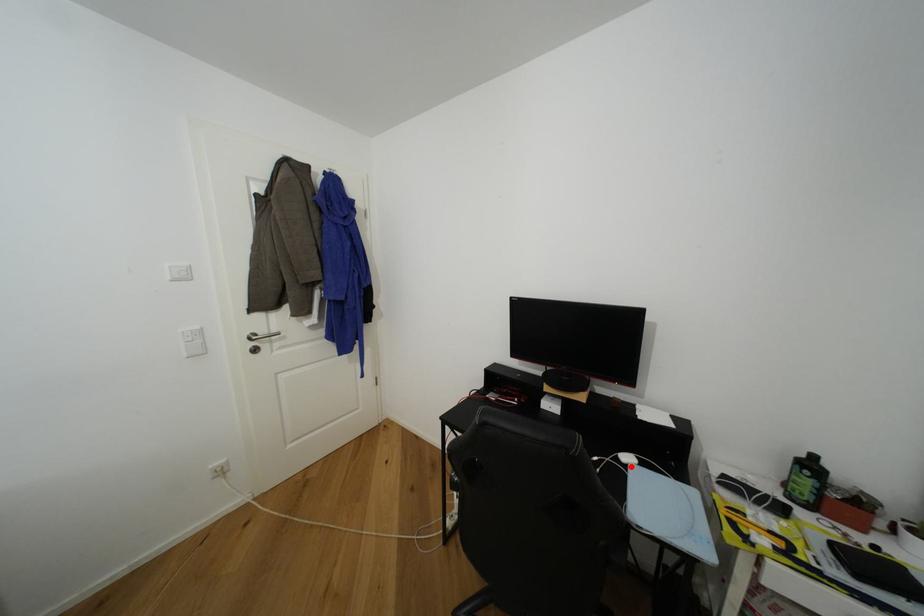
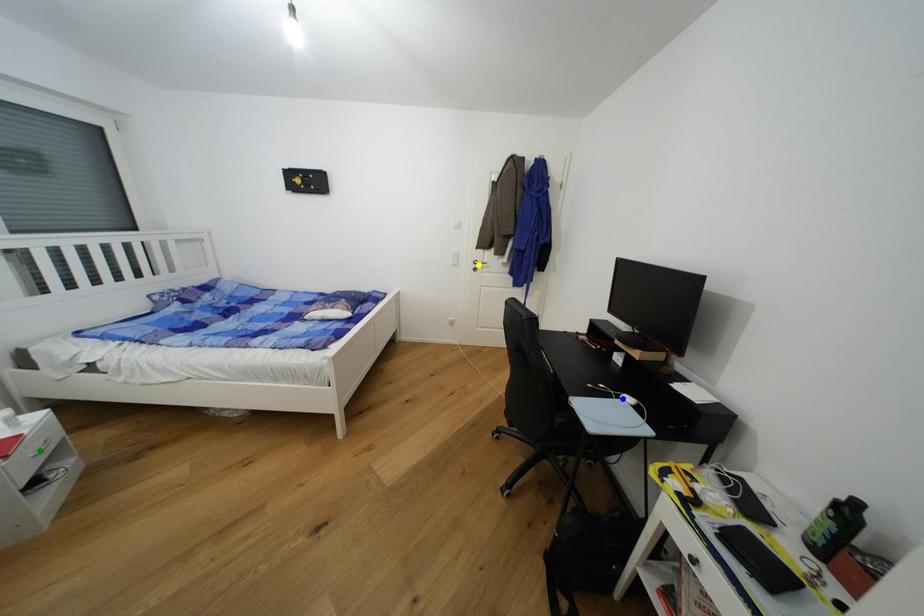
Question: I am providing you with two images of the same scene from different viewpoints. A red point is marked on the first image. You are given multiple points on the second image. Can you choose the point in image 2 that corresponds to the point in image 1?

Choices:
 (A) blue point
 (B) green point
 (C) yellow point

Answer: (A)